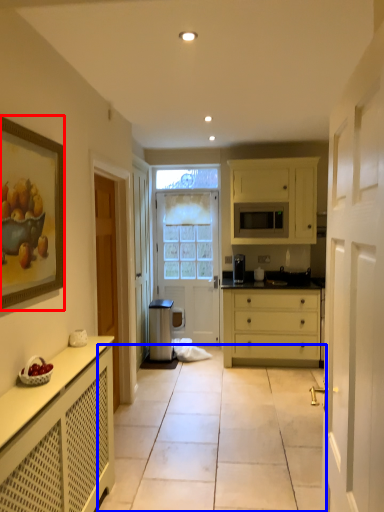
Question: Which object appears farthest to the camera in this image, picture frame (highlighted by a red box) or path (highlighted by a blue box)?

Choices:
 (A) picture frame
 (B) path

Answer: (B)